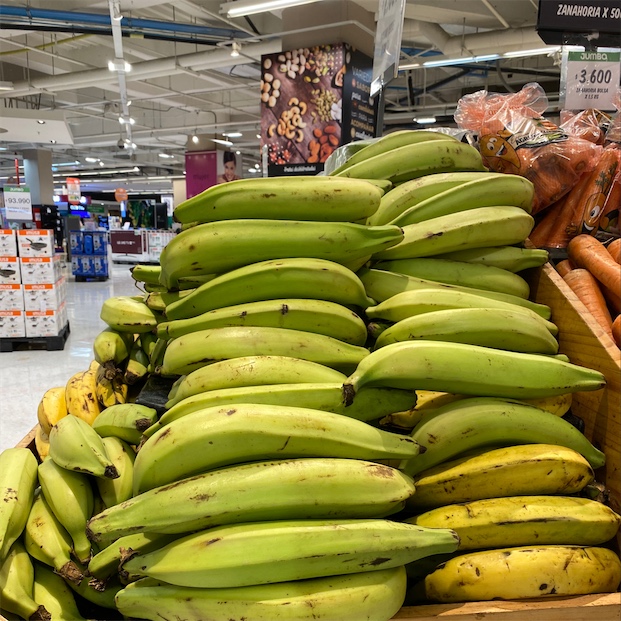
Locate an element on the screen. ceiling is located at coordinates pyautogui.click(x=153, y=40).